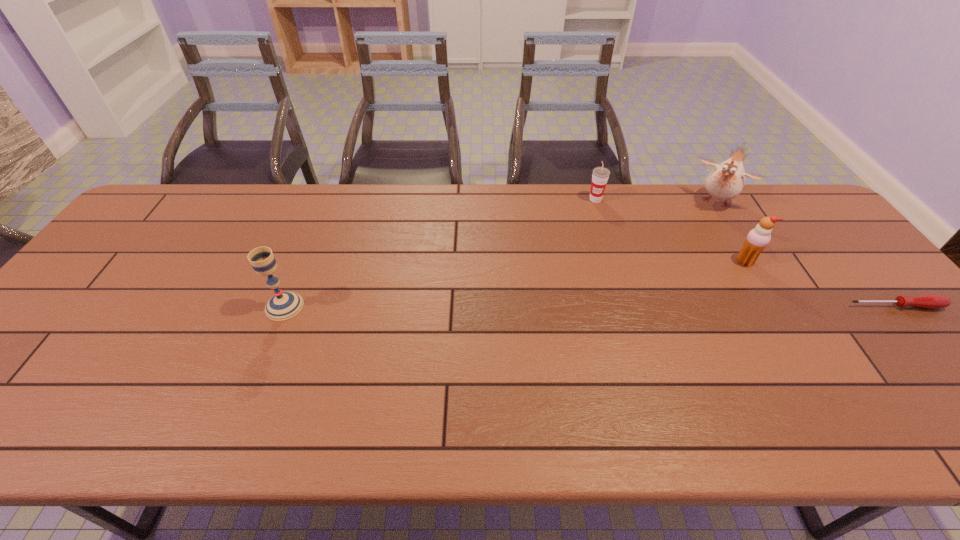
This screenshot has height=540, width=960. What are the coordinates of `object present at the right edge` in the screenshot? It's located at (930, 301).

The width and height of the screenshot is (960, 540). I want to click on free spot at the far edge of the desktop, so click(x=459, y=203).

I want to click on vacant space at the near edge of the desktop, so click(563, 381).

The width and height of the screenshot is (960, 540). Find the location of `blank space at the left edge`. blank space at the left edge is located at coordinates (128, 257).

This screenshot has width=960, height=540. In the image, there is a desktop. What are the coordinates of `free space at the right edge` in the screenshot? It's located at (869, 305).

In the image, there is a desktop. In order to click on vacant space at the far left corner in this screenshot , I will do [x=202, y=191].

In the image, there is a desktop. Where is `vacant space at the near left corner`? vacant space at the near left corner is located at coordinates (31, 380).

Locate an element on the screen. vacant space at the far right corner of the desktop is located at coordinates (780, 211).

Locate an element on the screen. This screenshot has width=960, height=540. free space between the cup and the leftmost object is located at coordinates (440, 253).

Where is `empty location between the bird and the fourth object from right to left`? The image size is (960, 540). empty location between the bird and the fourth object from right to left is located at coordinates (657, 200).